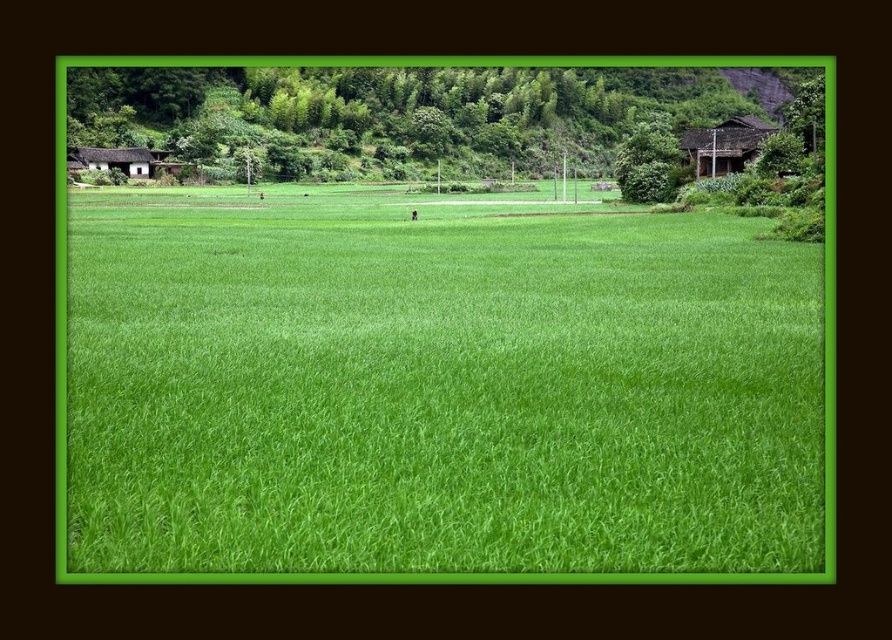
Is green grass at center wider than brown wooden hut at left?

Yes.

Is green grass at center to the right of brown wooden hut at left from the viewer's perspective?

Correct, you'll find green grass at center to the right of brown wooden hut at left.

What do you see at coordinates (438, 388) in the screenshot? I see `green grass at center` at bounding box center [438, 388].

Identify the location of green grass at center. The width and height of the screenshot is (892, 640). (438, 388).

Is brown wooden hut at upper right thinner than brown wooden hut at left?

Incorrect, brown wooden hut at upper right's width is not less than brown wooden hut at left's.

Is brown wooden hut at upper right shorter than brown wooden hut at left?

No, brown wooden hut at upper right is not shorter than brown wooden hut at left.

Which is in front, point (727, 122) or point (106, 156)?

Positioned in front is point (727, 122).

At what (x,y) coordinates should I click in order to perform the action: click on brown wooden hut at upper right. Please return your answer as a coordinate pair (x, y). This screenshot has height=640, width=892. Looking at the image, I should click on (725, 145).

What do you see at coordinates (438, 388) in the screenshot? I see `green grass at center` at bounding box center [438, 388].

Is green grass at center below brown wooden hut at upper right?

Yes, green grass at center is below brown wooden hut at upper right.

Is point (720, 554) closer to camera compared to point (691, 145)?

Yes.

This screenshot has width=892, height=640. Identify the location of green grass at center. (438, 388).